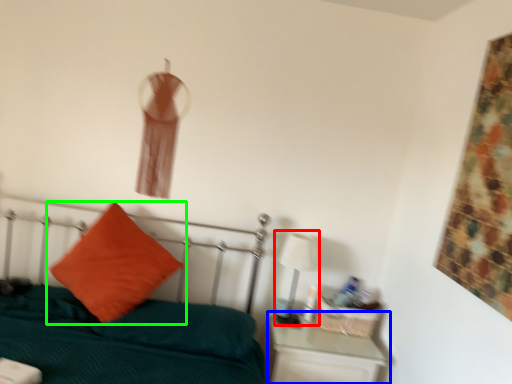
Question: Which object is positioned farthest from table lamp (highlighted by a red box)? Select from nightstand (highlighted by a blue box) and pillow (highlighted by a green box).

Choices:
 (A) nightstand
 (B) pillow

Answer: (B)